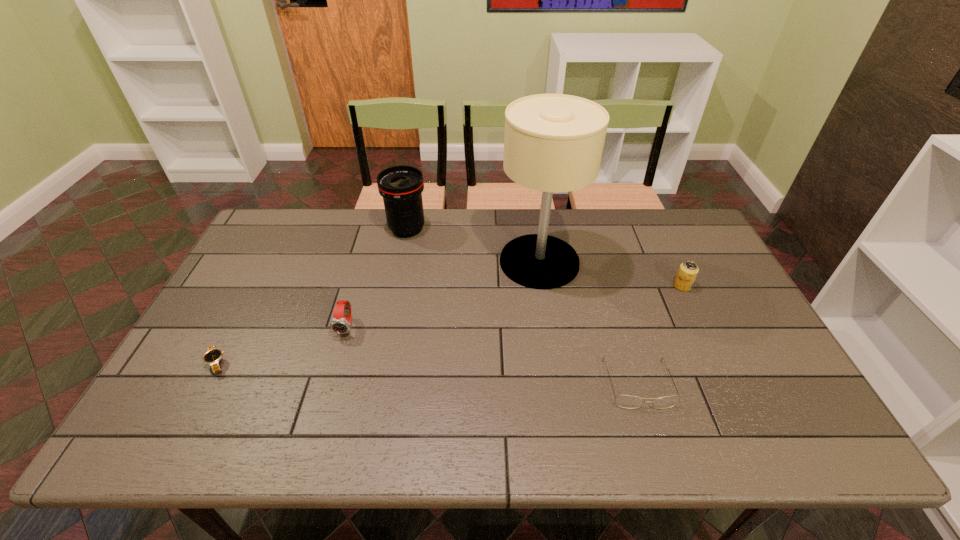
This screenshot has width=960, height=540. In order to click on free space located on the left of the telephoto lens in this screenshot , I will do `click(274, 229)`.

At what (x,y) coordinates should I click in order to perform the action: click on free space located 0.080m on the front of the rightmost object. Please return your answer as a coordinate pair (x, y). The height and width of the screenshot is (540, 960). Looking at the image, I should click on (694, 312).

Where is `vacant space situated 0.210m on the face of the fifth object from right to left`? vacant space situated 0.210m on the face of the fifth object from right to left is located at coordinates (324, 409).

Image resolution: width=960 pixels, height=540 pixels. Identify the location of blank area located 0.060m on the front-facing side of the fifth tallest object. (654, 434).

Find the location of `vacant space situated 0.160m on the right of the shorter watch`. vacant space situated 0.160m on the right of the shorter watch is located at coordinates (292, 363).

Where is `table lamp located in the far edge section of the desktop`? This screenshot has width=960, height=540. table lamp located in the far edge section of the desktop is located at coordinates (553, 142).

Locate an element on the screen. Image resolution: width=960 pixels, height=540 pixels. telephoto lens positioned at the far edge is located at coordinates (401, 187).

Locate an element on the screen. object situated at the left edge is located at coordinates (213, 356).

Locate an element on the screen. object present at the right edge is located at coordinates (688, 270).

In the image, there is a desktop. Identify the location of vacant space at the far edge. (484, 229).